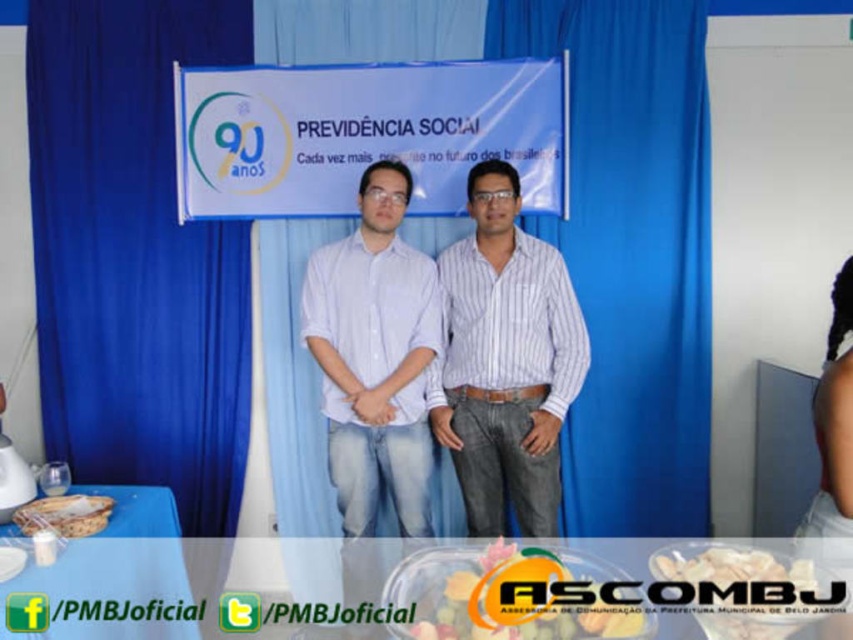
You are organizing a small event and need to decide which item to place in a narrow display case. The case can only accommodate items that are less than 10 cm in thickness. You have the white striped shirt at center and the translucent plastic container at center. Based on their thickness, which item is more likely to fit in the display case?

The white striped shirt at center is thinner than the translucent plastic container at center, so the white striped shirt at center is more likely to fit in the display case since it is thinner and under the 10 cm thickness requirement.

You are at a celebration for the 90th anniversary of Previdencia Social. You see a white striped shirt at center and a translucent plastic container at center. Which object is located to the left of the other?

The white striped shirt at center is positioned on the right side of the translucent plastic container at center, so the translucent plastic container at center is to the left of the white striped shirt at center.